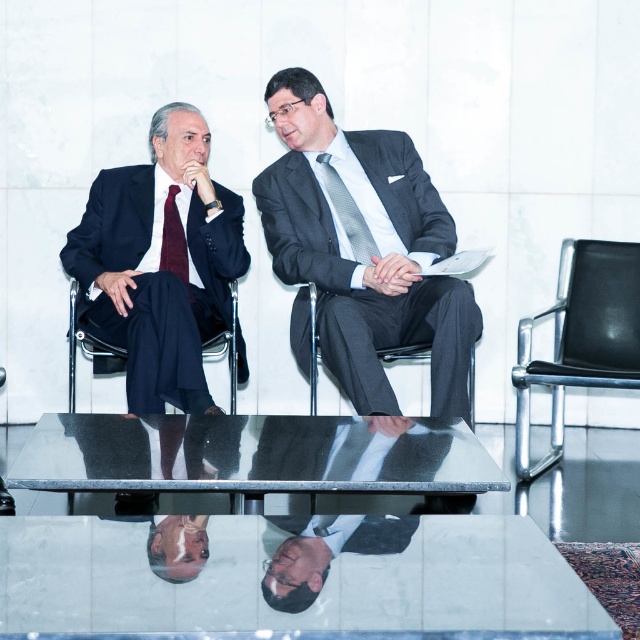
Is black leather chair at right shorter than gray textured tie at center?

In fact, black leather chair at right may be taller than gray textured tie at center.

Which is above, black leather chair at right or gray textured tie at center?

gray textured tie at center

Is point (564, 248) farther from camera compared to point (333, 204)?

Yes, point (564, 248) is farther from viewer.

The image size is (640, 640). Identify the location of black leather chair at right. (580, 337).

How distant is black leather chair at left from burgundy silk tie at left?

The distance of black leather chair at left from burgundy silk tie at left is 12.02 inches.

Who is more distant from viewer, (x=72, y=284) or (x=164, y=227)?

Point (x=164, y=227)

Between point (84, 339) and point (168, 204), which one is positioned behind?

The point (168, 204) is more distant.

Locate an element on the screen. The width and height of the screenshot is (640, 640). black leather chair at left is located at coordinates (83, 342).

Where is `dark gray suit at center`? Image resolution: width=640 pixels, height=640 pixels. dark gray suit at center is located at coordinates (364, 248).

Who is positioned more to the right, dark gray suit at center or burgundy silk tie at left?

Positioned to the right is dark gray suit at center.

Is point (310, 262) positioned after point (161, 259)?

No, (310, 262) is closer to viewer.

Identify the location of dark gray suit at center. (364, 248).